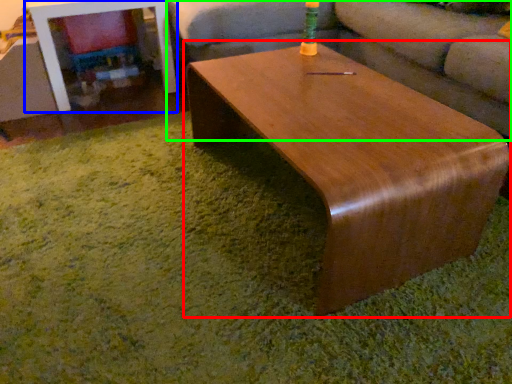
Question: Estimate the real-world distances between objects in this image. Which object is farther from coffee table (highlighted by a red box), table (highlighted by a blue box) or studio couch (highlighted by a green box)?

Choices:
 (A) table
 (B) studio couch

Answer: (A)